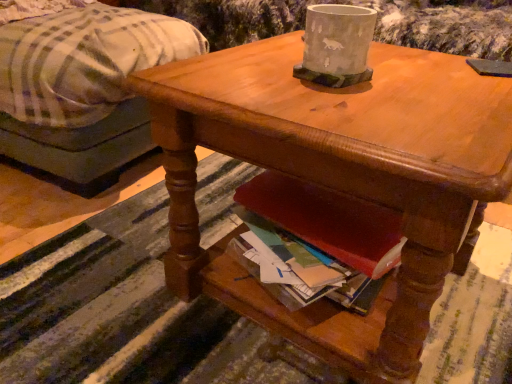
Question: Considering the relative sizes of plaid fabric ottoman at left and wooden desk at center in the image provided, is plaid fabric ottoman at left taller than wooden desk at center?

Choices:
 (A) yes
 (B) no

Answer: (A)

Question: Is plaid fabric ottoman at left in contact with wooden desk at center?

Choices:
 (A) yes
 (B) no

Answer: (B)

Question: Can you confirm if plaid fabric ottoman at left is shorter than wooden desk at center?

Choices:
 (A) no
 (B) yes

Answer: (A)

Question: Does plaid fabric ottoman at left have a smaller size compared to wooden desk at center?

Choices:
 (A) no
 (B) yes

Answer: (A)

Question: Does plaid fabric ottoman at left have a lesser width compared to wooden desk at center?

Choices:
 (A) no
 (B) yes

Answer: (A)

Question: Considering the relative positions of plaid fabric ottoman at left and wooden desk at center in the image provided, is plaid fabric ottoman at left to the left of wooden desk at center from the viewer's perspective?

Choices:
 (A) yes
 (B) no

Answer: (A)

Question: Does plaid fabric ottoman at left touch gray concrete pot at upper center?

Choices:
 (A) no
 (B) yes

Answer: (A)

Question: Is plaid fabric ottoman at left thinner than gray concrete pot at upper center?

Choices:
 (A) yes
 (B) no

Answer: (B)

Question: Is plaid fabric ottoman at left positioned beyond the bounds of gray concrete pot at upper center?

Choices:
 (A) no
 (B) yes

Answer: (B)

Question: Does plaid fabric ottoman at left have a smaller size compared to gray concrete pot at upper center?

Choices:
 (A) yes
 (B) no

Answer: (B)

Question: From the image's perspective, is plaid fabric ottoman at left on gray concrete pot at upper center?

Choices:
 (A) yes
 (B) no

Answer: (A)

Question: Considering the relative sizes of plaid fabric ottoman at left and gray concrete pot at upper center in the image provided, is plaid fabric ottoman at left taller than gray concrete pot at upper center?

Choices:
 (A) no
 (B) yes

Answer: (B)

Question: Is wooden desk at center further to the viewer compared to plaid fabric ottoman at left?

Choices:
 (A) yes
 (B) no

Answer: (B)